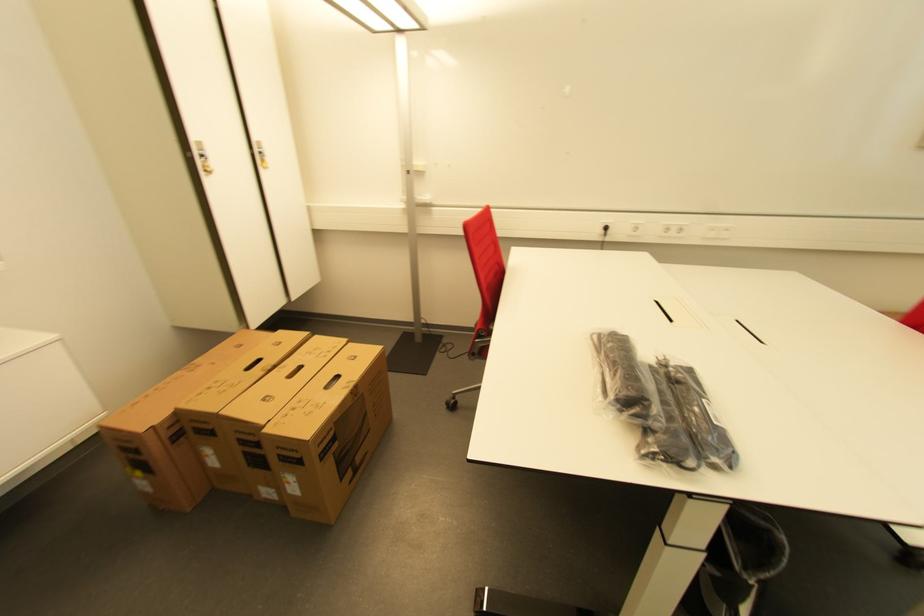
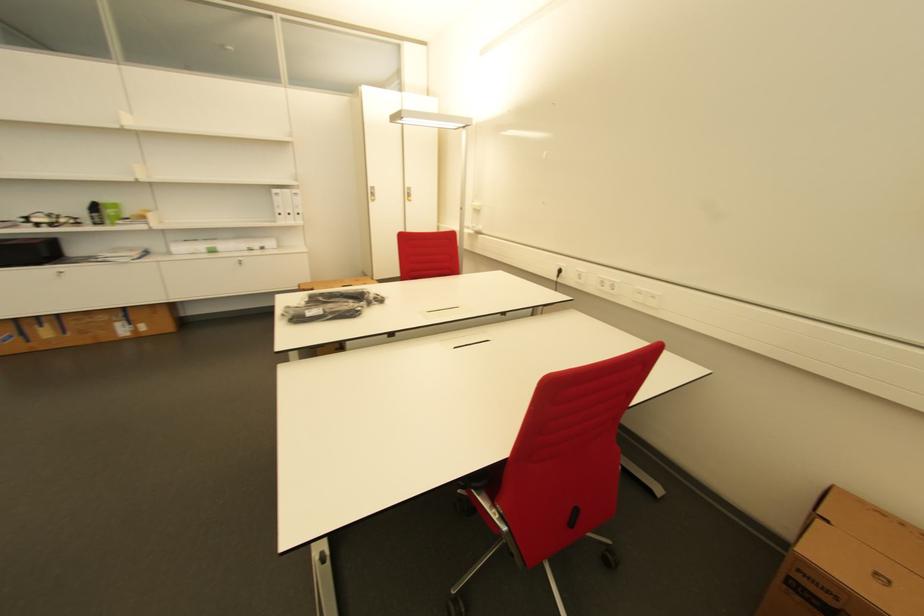
The point at (676,233) is marked in the first image. Where is the corresponding point in the second image?

(612, 289)